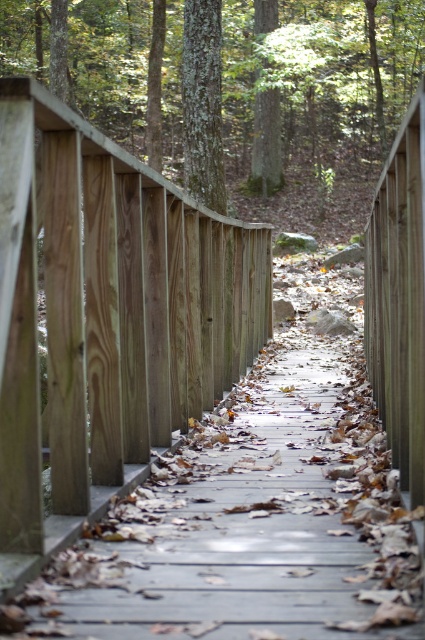
You are a hiker walking along the boardwalk and want to place a 3 meter long wooden bench between the smooth brown tree trunk at center and the green mossy tree at center. Will the bench fit between them?

The smooth brown tree trunk at center is 3.25 meters from the green mossy tree at center. Since the bench is 3 meters long, it will fit between them with a small amount of space remaining.

You are standing on the wooden boardwalk in the forest and want to locate the smooth brown tree trunk at center. Based on its coordinates, where should you look relative to your position?

The smooth brown tree trunk at center is located at coordinates point [320,77], which is to the lower left of your current position on the boardwalk.